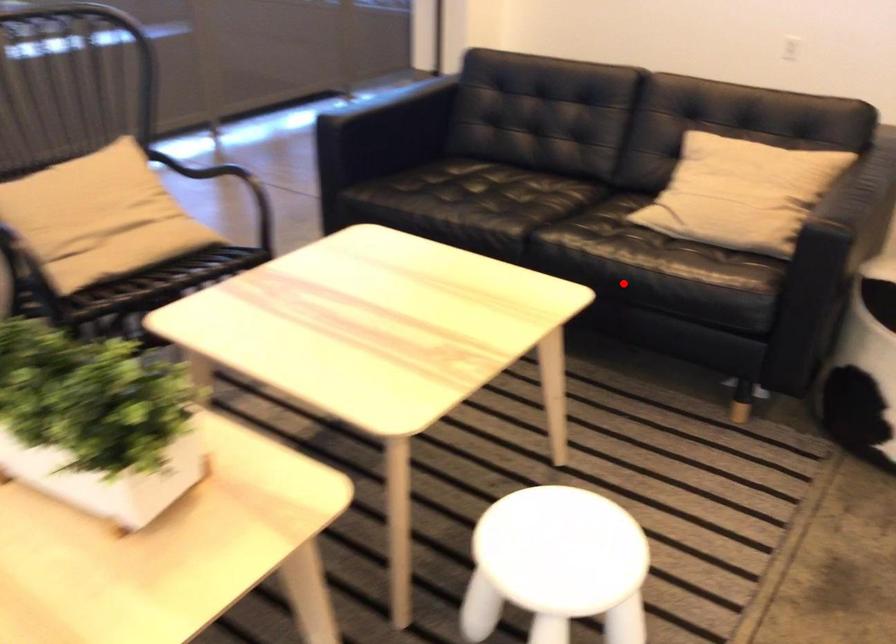
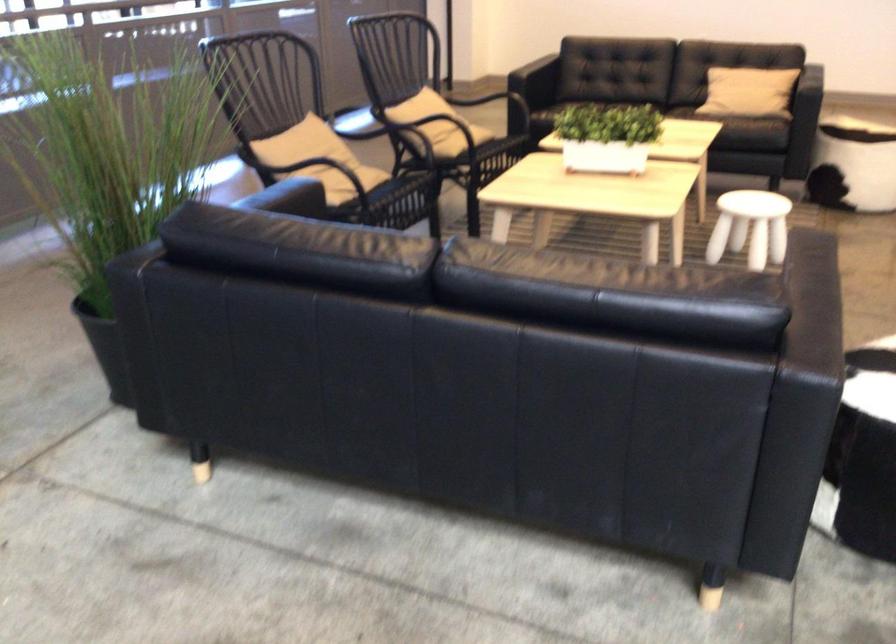
Question: I am providing you with two images of the same scene from different viewpoints. Given a red point in image1, look at the same physical point in image2. Is it:

Choices:
 (A) Closer to the viewpoint
 (B) Farther from the viewpoint

Answer: (B)